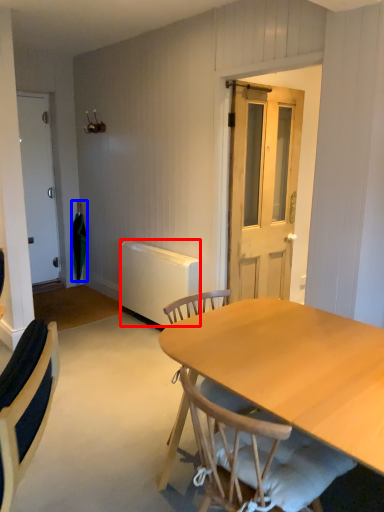
Question: Which of the following is the farthest to the observer, radiator (highlighted by a red box) or umbrella (highlighted by a blue box)?

Choices:
 (A) radiator
 (B) umbrella

Answer: (B)